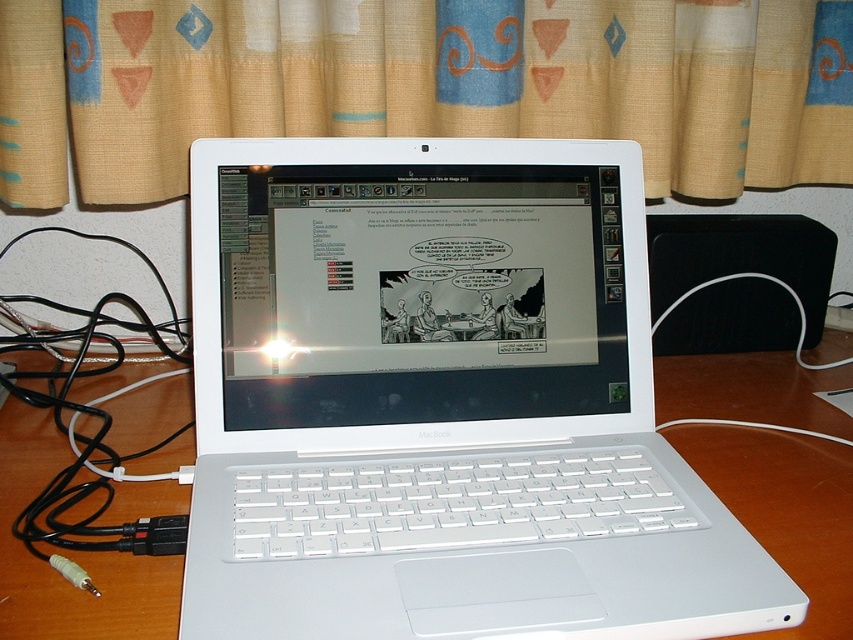
Question: Which is farther from the beige fabric curtain at upper center?

Choices:
 (A) white glossy laptop screen at center
 (B) black cable at left
 (C) white plastic laptop at center

Answer: (B)

Question: Does white plastic laptop at center have a larger size compared to white glossy laptop screen at center?

Choices:
 (A) yes
 (B) no

Answer: (A)

Question: Which point appears farthest from the camera in this image?

Choices:
 (A) (618, 196)
 (B) (589, 284)

Answer: (A)

Question: Does white glossy laptop screen at center have a greater width compared to black cable at left?

Choices:
 (A) no
 (B) yes

Answer: (A)

Question: Which object is the farthest from the white plastic laptop at center?

Choices:
 (A) white glossy laptop screen at center
 (B) beige fabric curtain at upper center

Answer: (B)

Question: From the image, what is the correct spatial relationship of beige fabric curtain at upper center in relation to black cable at left?

Choices:
 (A) left
 (B) right

Answer: (B)